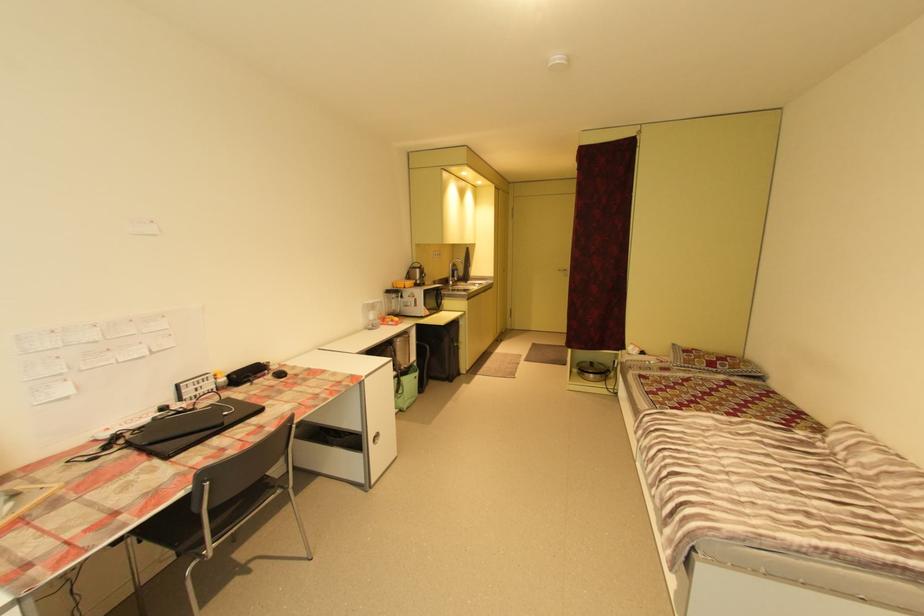
Identify the location of silver kettle handle. This screenshot has height=616, width=924. (407, 273).